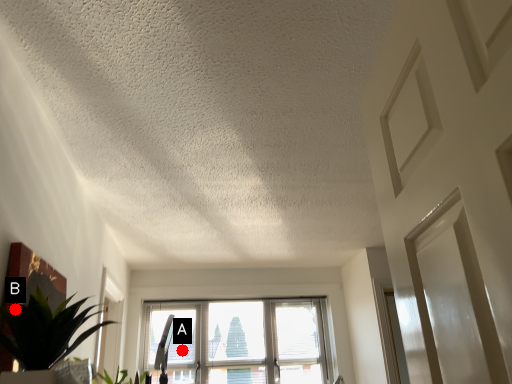
Question: Two points are circled on the image, labeled by A and B beside each circle. Which point is farther to the camera?

Choices:
 (A) A is further
 (B) B is further

Answer: (A)